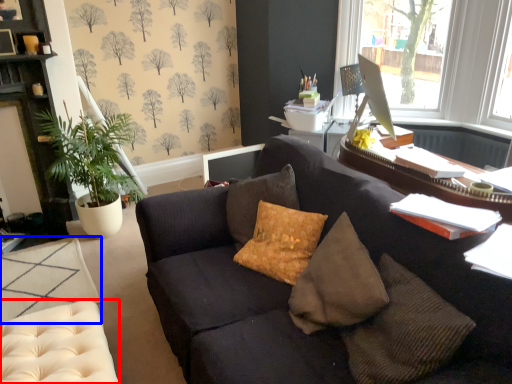
Question: Which point is closer to the camera, swivel chair (highlighted by a red box) or footrest (highlighted by a blue box)?

Choices:
 (A) swivel chair
 (B) footrest

Answer: (A)